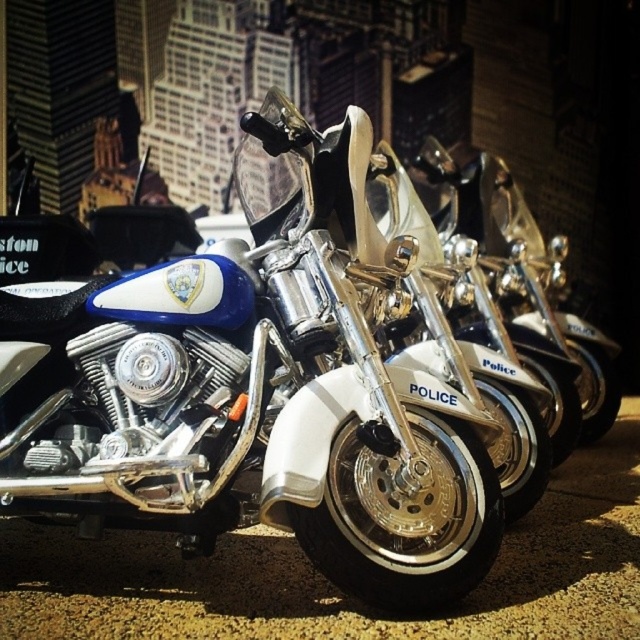
You are a police officer who needs to park your motorcycle on the black asphalt pavement at center. Where should you position your motorcycle relative to the white glossy police motorcycle at center?

The white glossy police motorcycle at center is positioned on the left side of black asphalt pavement at center, so you should park your motorcycle to the right side of the white glossy police motorcycle at center to align with the existing parking arrangement.

You are a delivery person who needs to park a motorcycle that is 2.5 feet wide in the garage. The motorcycle must be parked on the black asphalt pavement at center. Can the white glossy police motorcycle at center be parked there without overlapping the pavement?

The white glossy police motorcycle at center is thinner than the black asphalt pavement at center, so it can be parked there without overlapping the pavement.

You are a police officer standing at the entrance of the garage facing the row of motorcycles. You need to locate two specific points marked on the motorcycles. The first point is at coordinate point (0, 454) and the second is at point (3, 636). Which point is closer to you as you face the motorcycles?

Point (3, 636) is closer to you because it is in front of point (0, 454).